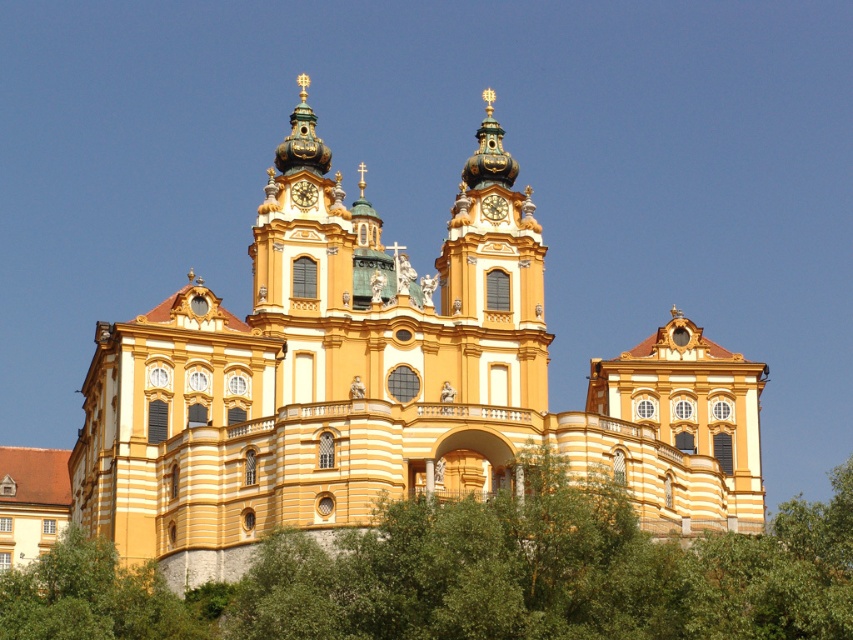
Question: Is yellow matte church at center further to the viewer compared to gold metallic clock at center?

Choices:
 (A) no
 (B) yes

Answer: (A)

Question: Does yellow matte church at center have a smaller size compared to gold metallic clock at center?

Choices:
 (A) no
 (B) yes

Answer: (A)

Question: Among these points, which one is nearest to the camera?

Choices:
 (A) (575, 589)
 (B) (78, 625)

Answer: (A)

Question: Can you confirm if gold metallic clock at center is thinner than gold metallic clock at upper center?

Choices:
 (A) no
 (B) yes

Answer: (A)

Question: Which point is closer to the camera?

Choices:
 (A) green leafy tree at lower center
 (B) gold metallic clock at upper center
 (C) gold metallic clock at center

Answer: (A)

Question: Which of the following is the closest to the observer?

Choices:
 (A) (525, 413)
 (B) (297, 196)
 (C) (492, 218)
 (D) (448, 602)

Answer: (D)